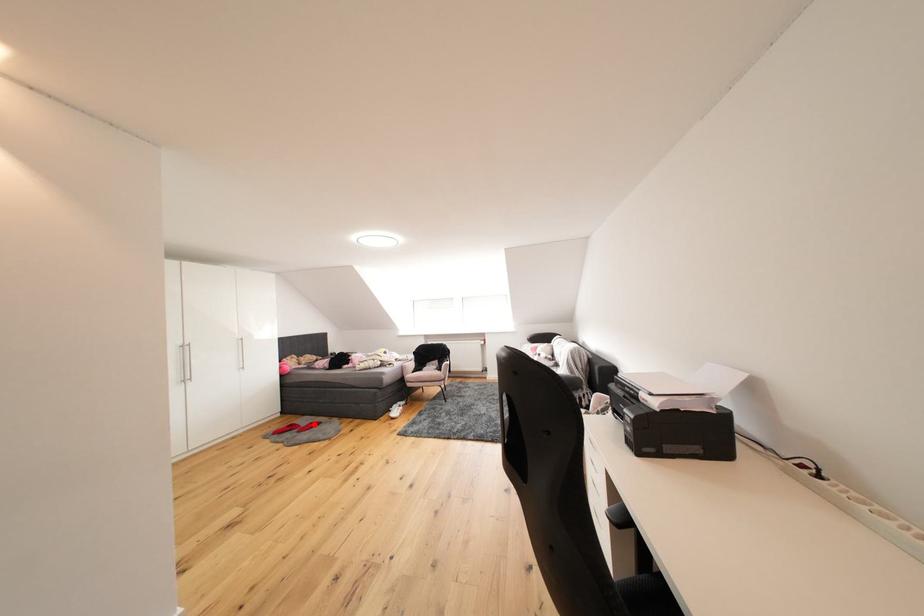
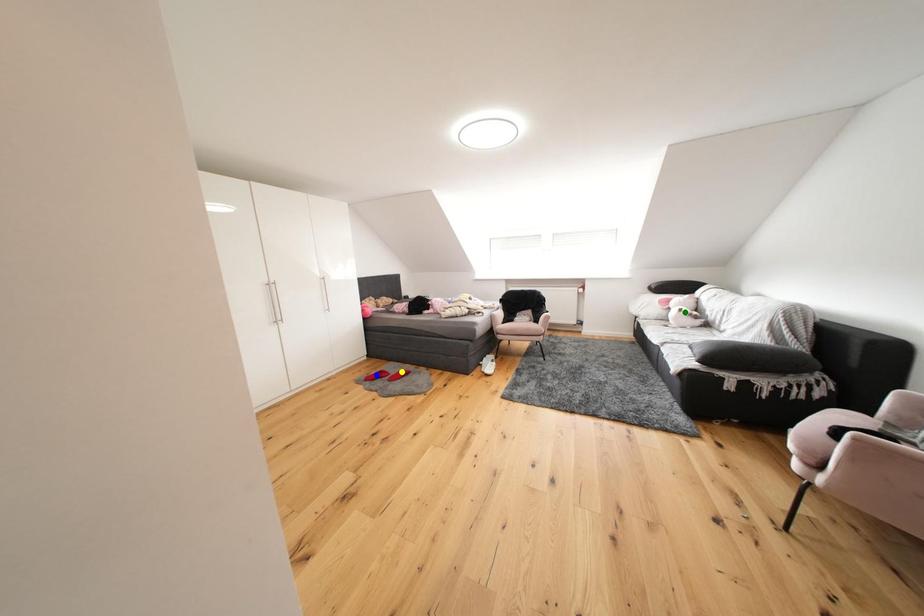
Question: I am providing you with two images of the same scene from different viewpoints. A red point is marked on the first image. You are given multiple points on the second image. Can you choose the point in image 2 that corresponds to the point in image 1?

Choices:
 (A) blue point
 (B) green point
 (C) yellow point

Answer: (C)